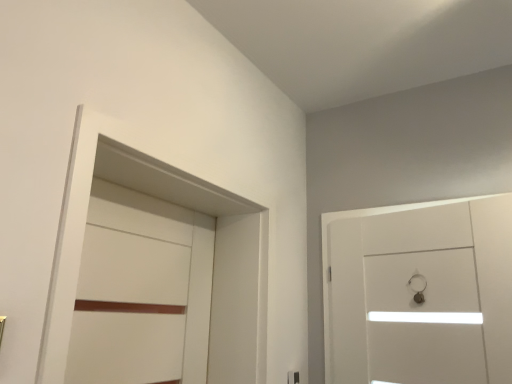
Question: From the image's perspective, relative to white matte locker at left, is white glossy door at right, the first door positioned from the right, above or below?

Choices:
 (A) above
 (B) below

Answer: (B)

Question: Is white glossy door at right, the first door positioned from the right, bigger or smaller than white matte locker at left?

Choices:
 (A) big
 (B) small

Answer: (B)

Question: Based on their relative distances, which object is nearer to the white glossy door at right, the first door positioned from the right?

Choices:
 (A) white matte door at left, arranged as the second door when viewed from the right
 (B) white matte locker at left

Answer: (B)

Question: Which object is the farthest from the white glossy door at right, the 2th door in the left-to-right sequence?

Choices:
 (A) white matte locker at left
 (B) white matte door at left, which ranks as the 1th door in left-to-right order

Answer: (B)